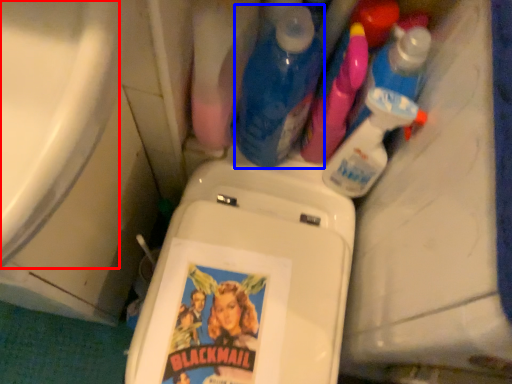
Question: Which point is closer to the camera, bath (highlighted by a red box) or cleaning product (highlighted by a blue box)?

Choices:
 (A) bath
 (B) cleaning product

Answer: (A)